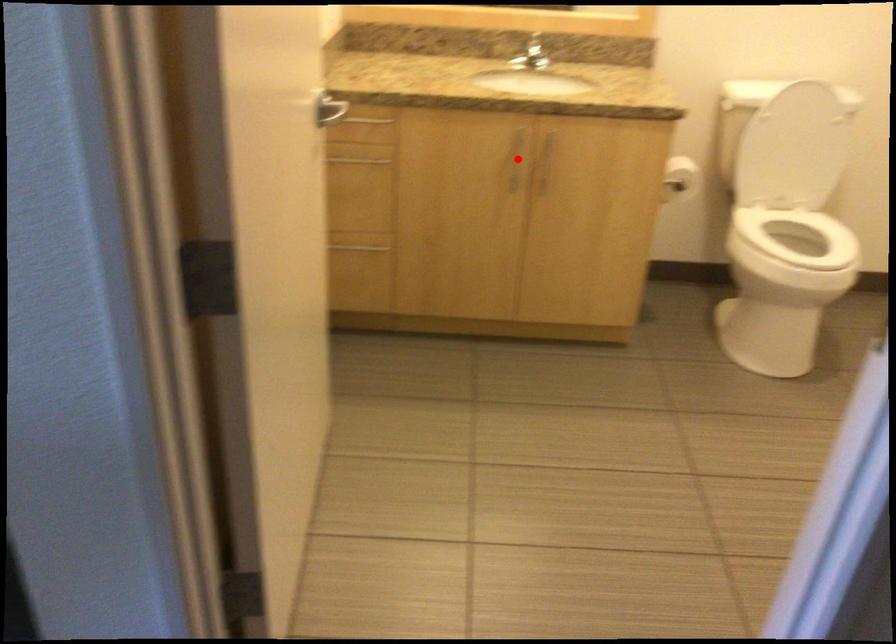
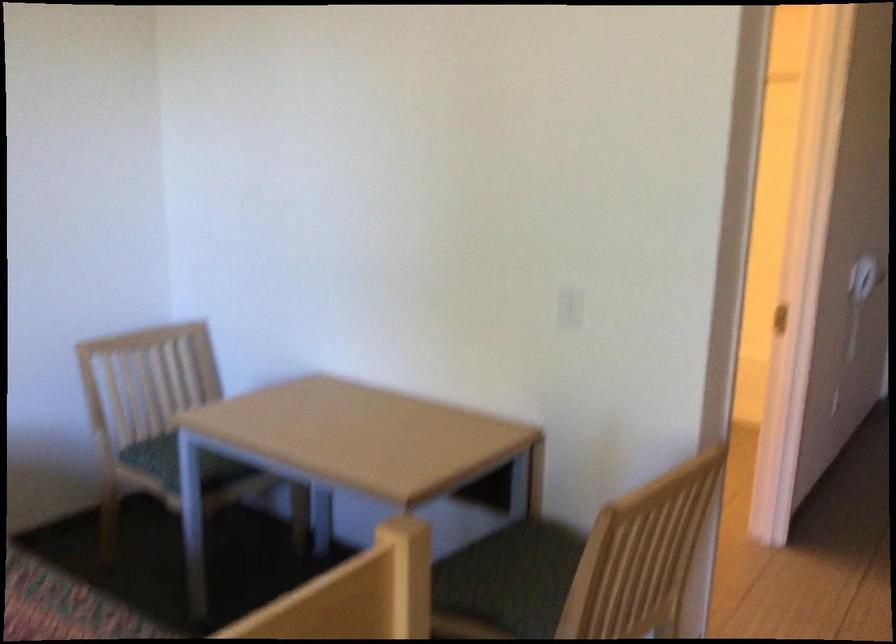
Question: I am providing you with two images of the same scene from different viewpoints. A red point is marked on the first image. Can you still see the location of the red point in image 2?

Choices:
 (A) Yes
 (B) No

Answer: (B)